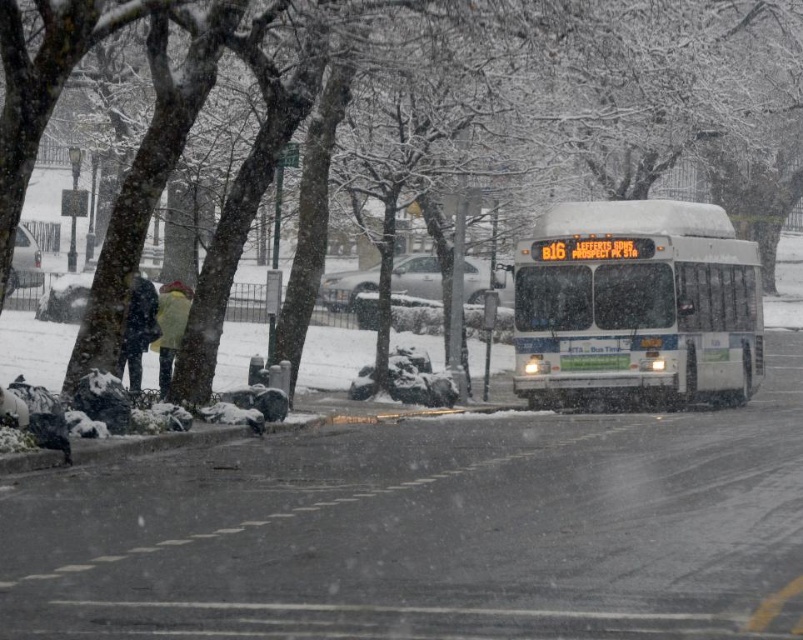
Question: Which point is farther to the camera?

Choices:
 (A) (581, 321)
 (B) (157, 385)

Answer: (A)

Question: Does white matte bus at center appear over dark blue jacket at center?

Choices:
 (A) no
 (B) yes

Answer: (B)

Question: Which object appears farthest from the camera in this image?

Choices:
 (A) dark blue jacket at center
 (B) white matte bus at center
 (C) yellow wool coat at left

Answer: (B)

Question: Can you confirm if dark blue jacket at center is positioned above yellow wool coat at left?

Choices:
 (A) yes
 (B) no

Answer: (B)

Question: In this image, where is dark blue jacket at center located relative to yellow wool coat at left?

Choices:
 (A) above
 (B) below

Answer: (B)

Question: Which is farther from the yellow wool coat at left?

Choices:
 (A) dark blue jacket at center
 (B) white matte bus at center

Answer: (B)